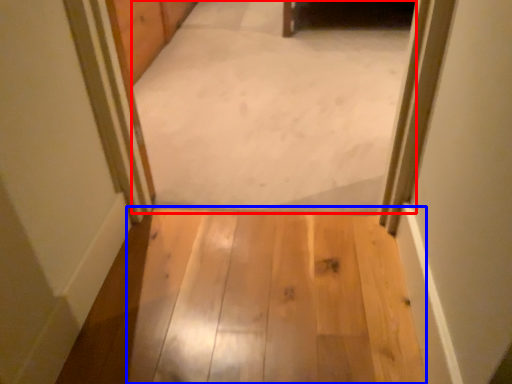
Question: Among these objects, which one is farthest to the camera, passage (highlighted by a red box) or path (highlighted by a blue box)?

Choices:
 (A) passage
 (B) path

Answer: (A)